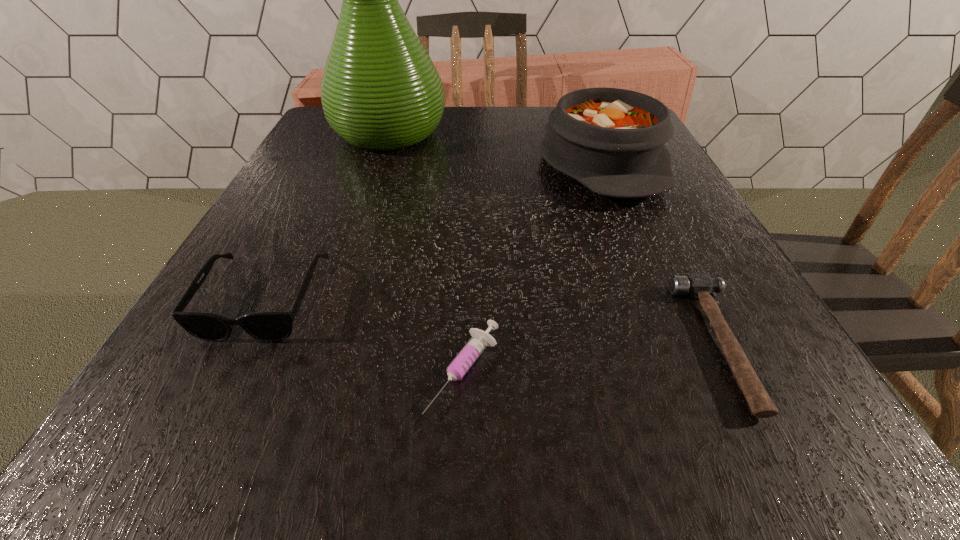
Where is `free location located 0.270m on the striking face of the hammer`? The height and width of the screenshot is (540, 960). free location located 0.270m on the striking face of the hammer is located at coordinates (494, 343).

In order to click on vacant region located on the front of the third object from right to left in this screenshot , I will do `click(461, 463)`.

You are a GUI agent. You are given a task and a screenshot of the screen. Output one action in this format:
    pyautogui.click(x=<x>, y=<y>)
    Task: Click on the vase at the far edge
    This screenshot has width=960, height=540.
    Given the screenshot: What is the action you would take?
    pyautogui.click(x=380, y=91)

Identify the location of casserole at the far edge. (611, 140).

Locate an element on the screen. hammer that is at the near edge is located at coordinates (699, 285).

Where is `syringe situated at the near edge`? The width and height of the screenshot is (960, 540). syringe situated at the near edge is located at coordinates (480, 339).

Identify the location of vase that is at the left edge. This screenshot has width=960, height=540. (380, 91).

Locate an element on the screen. sunglasses positioned at the left edge is located at coordinates (267, 326).

Locate an element on the screen. casserole present at the right edge is located at coordinates (611, 140).

At what (x,y) coordinates should I click in order to perform the action: click on hammer that is at the right edge. Please return your answer as a coordinate pair (x, y). Looking at the image, I should click on (699, 285).